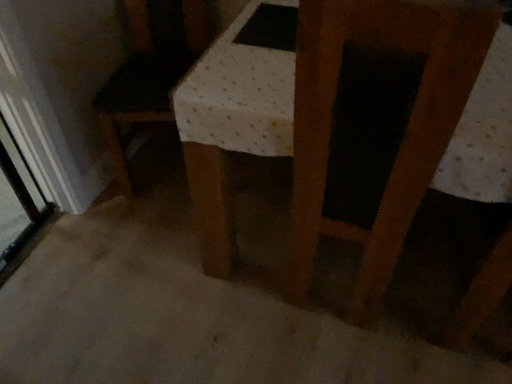
The image size is (512, 384). Find the location of `free space that is to the left of wooden table at center`. free space that is to the left of wooden table at center is located at coordinates (145, 264).